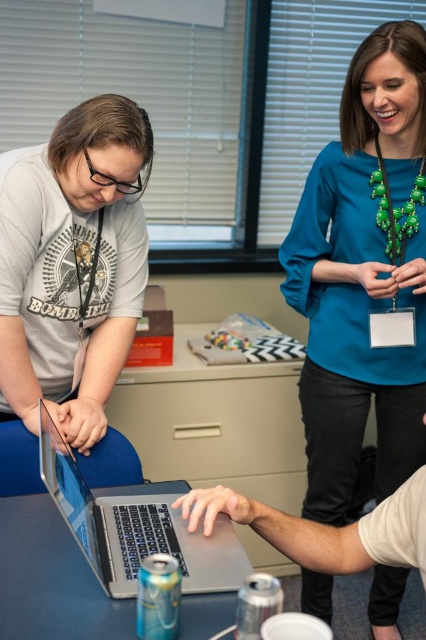
You are a delivery person who needs to place a small package on the desk in this office scene. The package is 10 cm tall. Can you place it on the silver metallic table at center without it being blocked by the matte gray laptop at center?

The matte gray laptop at center is taller than the silver metallic table at center. Since the laptop is taller than the table, placing the package on the table might not be possible as the laptop could block the space. However, the package is only 10 cm tall. If the table has enough surface area around the laptop, the package could be placed there, but the height of the laptop might cast a shadow or block visibility. However, since the question is about physical placement and not visibility, the answer is a

You are a person who wants to place a new keyboard on the desk. You have a keyboard that is 1.2 meters long. The desk has a length of 1.5 meters. Can you place the keyboard on the silver metallic table at center without overlapping the matte gray laptop at center?

The silver metallic table at center is behind the matte gray laptop at center, so you can place the keyboard on the silver metallic table at center as long as it does not overlap the laptop. Since the keyboard is 1.2 meters long and the table is 1.5 meters long, there is enough space to place it without overlapping the laptop.

Based on the photo, you have a large document that requires a workspace wider than the laptop. Can the silver metallic table at center accommodate the document alongside the matte gray laptop at center?

The matte gray laptop at center is narrower than the silver metallic table at center, so there should be enough space on the silver metallic table at center to place the document next to the laptop.